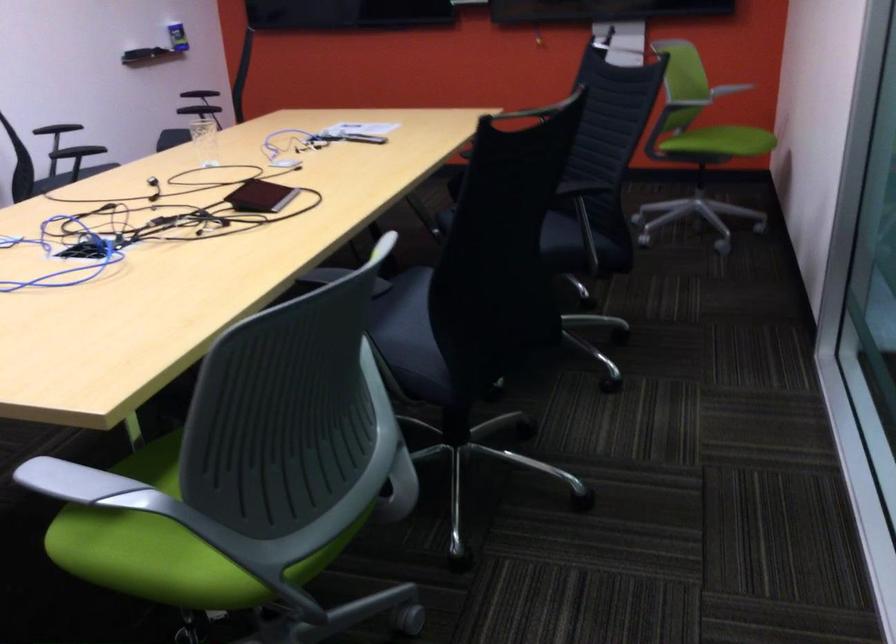
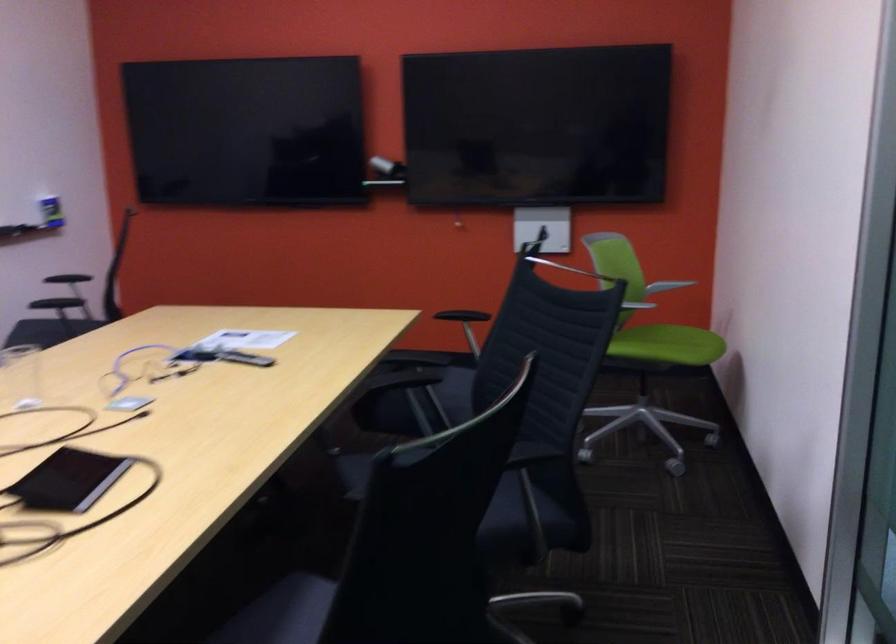
In the second image, find the point that corresponds to the point at 725,134 in the first image.

(667, 345)